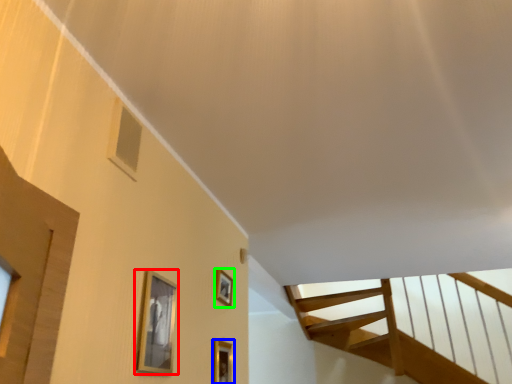
Question: Which object is positioned farthest from picture frame (highlighted by a red box)? Select from picture frame (highlighted by a blue box) and picture frame (highlighted by a green box).

Choices:
 (A) picture frame
 (B) picture frame

Answer: (B)